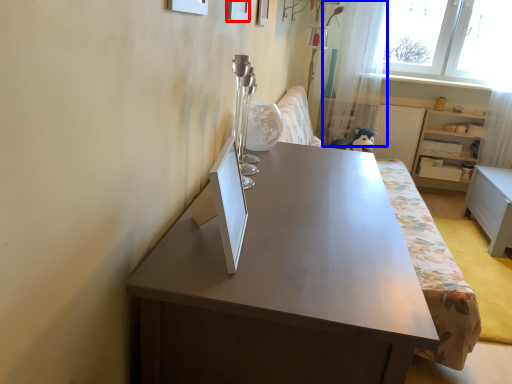
Question: Which object appears closest to the camera in this image, picture frame (highlighted by a red box) or curtain (highlighted by a blue box)?

Choices:
 (A) picture frame
 (B) curtain

Answer: (A)